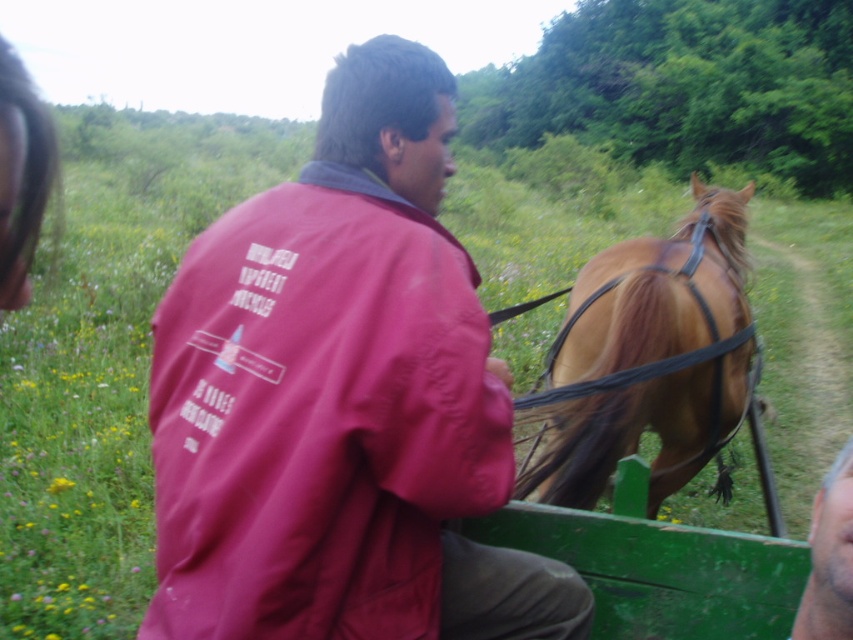
Does matte red jacket at center appear over shiny brown horse at right?

Yes, matte red jacket at center is above shiny brown horse at right.

Does matte red jacket at center have a smaller size compared to shiny brown horse at right?

Correct, matte red jacket at center occupies less space than shiny brown horse at right.

Is point (252, 534) positioned in front of point (550, 360)?

Yes, point (252, 534) is closer to viewer.

Where is `matte red jacket at center`? The height and width of the screenshot is (640, 853). matte red jacket at center is located at coordinates (341, 400).